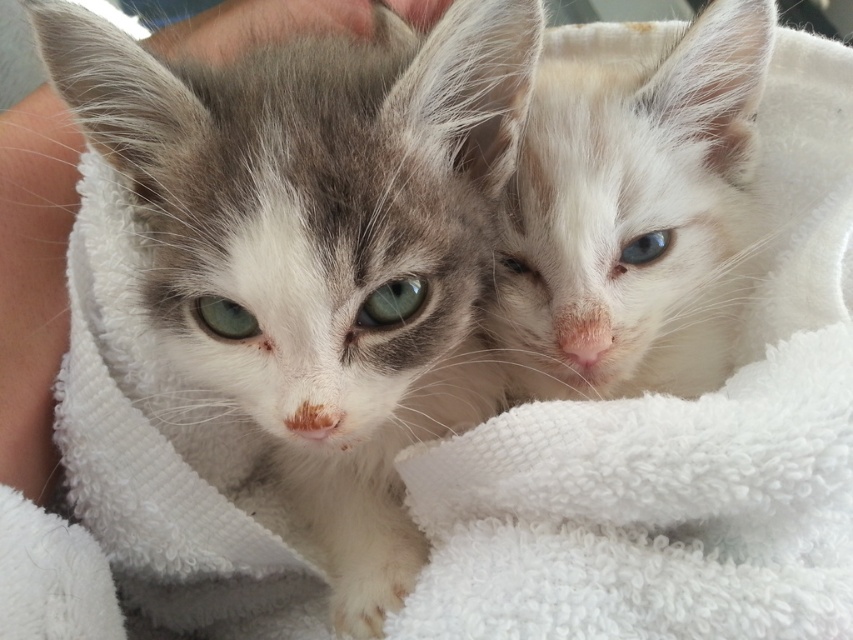
You are a photographer trying to capture a closeup of the blue glossy eye at upper right without the white fluffy cat at upper right blocking the view. Is this possible given their current positions?

The white fluffy cat at upper right is positioned over the blue glossy eye at upper right, so it would block the view. To capture the blue glossy eye at upper right without obstruction, you would need to adjust the angle or move the white fluffy cat at upper right slightly.

Consider the image. You are a veterinarian examining two kittens. You notice their eyes, the green matte eye at center and the blue glossy eye at upper right. Which eye has a smaller vertical size?

The green matte eye at center has a lesser height compared to the blue glossy eye at upper right, so the green matte eye at center has a smaller vertical size.

You are a veterinarian examining two kittens. You notice their eyes, the green glossy eye at center and the blue glossy eye at upper right. Which eye has a larger size?

The green glossy eye at center is bigger than the blue glossy eye at upper right, so the green glossy eye at center has a larger size.